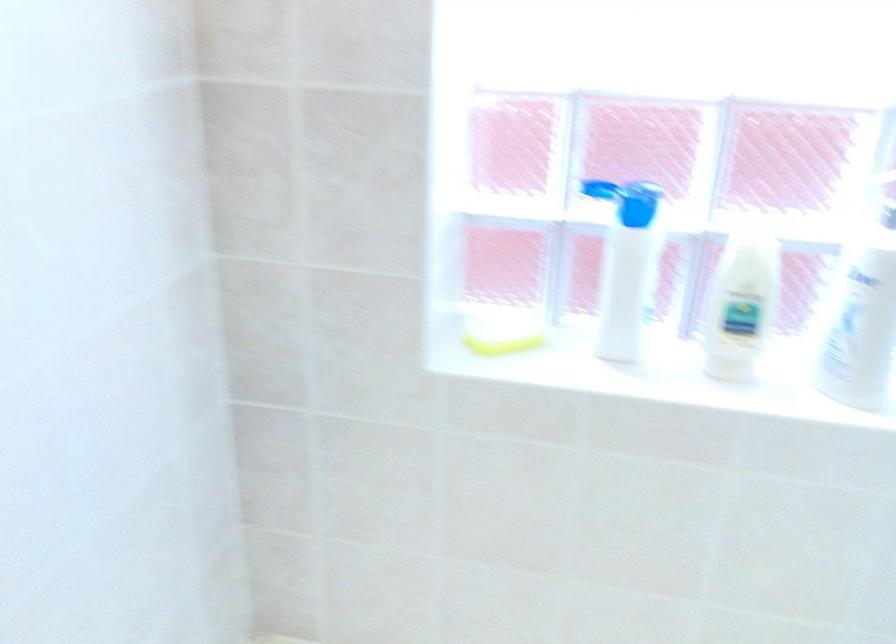
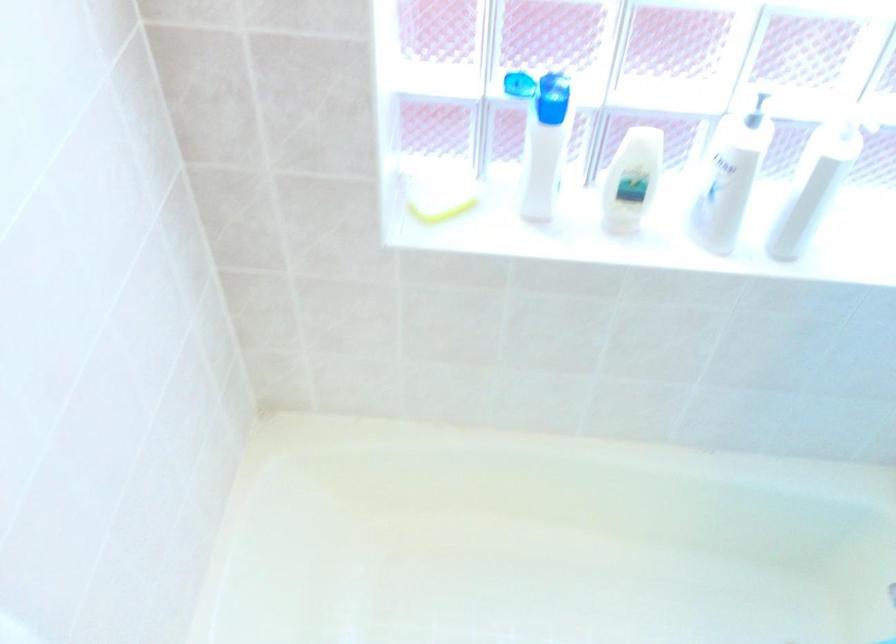
Where in the second image is the point corresponding to pixel 500 330 from the first image?

(438, 196)